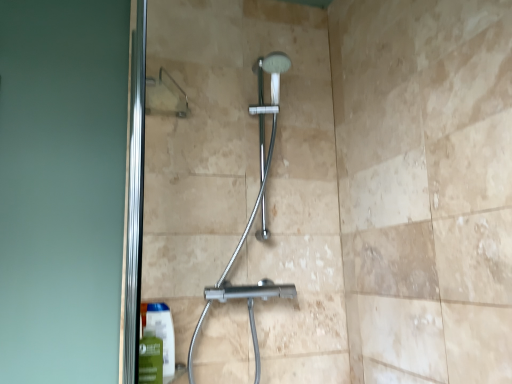
Question: Considering the relative sizes of green matte mouthwash at lower left and chrome metallic shower at center in the image provided, is green matte mouthwash at lower left smaller than chrome metallic shower at center?

Choices:
 (A) yes
 (B) no

Answer: (A)

Question: Are green matte mouthwash at lower left and chrome metallic shower at center located far from each other?

Choices:
 (A) yes
 (B) no

Answer: (B)

Question: Is chrome metallic shower at center a part of green matte mouthwash at lower left?

Choices:
 (A) no
 (B) yes

Answer: (A)

Question: Is green matte mouthwash at lower left behind chrome metallic shower at center?

Choices:
 (A) yes
 (B) no

Answer: (A)

Question: Can you confirm if green matte mouthwash at lower left is bigger than chrome metallic shower at center?

Choices:
 (A) no
 (B) yes

Answer: (A)

Question: In the image, is chrome metallic shower at center on the left side or the right side of transparent glass door at upper left?

Choices:
 (A) right
 (B) left

Answer: (A)

Question: Is chrome metallic shower at center inside or outside of transparent glass door at upper left?

Choices:
 (A) inside
 (B) outside

Answer: (B)

Question: From a real-world perspective, relative to transparent glass door at upper left, is chrome metallic shower at center vertically above or below?

Choices:
 (A) below
 (B) above

Answer: (A)

Question: Is point (272, 134) positioned closer to the camera than point (243, 82)?

Choices:
 (A) farther
 (B) closer

Answer: (B)

Question: Does point (148, 365) appear closer or farther from the camera than point (263, 286)?

Choices:
 (A) farther
 (B) closer

Answer: (B)

Question: From a real-world perspective, is green matte mouthwash at lower left physically located above or below chrome metallic shower at center?

Choices:
 (A) above
 (B) below

Answer: (B)

Question: Considering the positions of green matte mouthwash at lower left and chrome metallic shower at center in the image, is green matte mouthwash at lower left bigger or smaller than chrome metallic shower at center?

Choices:
 (A) small
 (B) big

Answer: (A)

Question: Considering the positions of green matte mouthwash at lower left and chrome metallic shower at center in the image, is green matte mouthwash at lower left taller or shorter than chrome metallic shower at center?

Choices:
 (A) tall
 (B) short

Answer: (B)

Question: Considering the positions of transparent glass door at upper left and green matte mouthwash at lower left in the image, is transparent glass door at upper left taller or shorter than green matte mouthwash at lower left?

Choices:
 (A) tall
 (B) short

Answer: (A)

Question: Is transparent glass door at upper left situated inside green matte mouthwash at lower left or outside?

Choices:
 (A) inside
 (B) outside

Answer: (B)